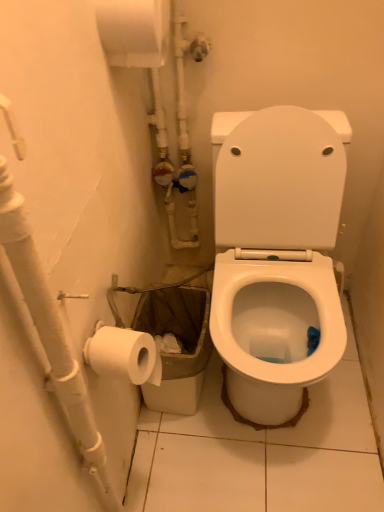
Question: Visually, is white matte water pipe at left positioned to the left or to the right of white matte toilet paper at upper left?

Choices:
 (A) left
 (B) right

Answer: (A)

Question: Relative to white matte toilet paper at upper left, is white matte water pipe at left in front or behind?

Choices:
 (A) front
 (B) behind

Answer: (A)

Question: Considering the positions of white matte water pipe at left and white matte toilet paper at upper left in the image, is white matte water pipe at left taller or shorter than white matte toilet paper at upper left?

Choices:
 (A) tall
 (B) short

Answer: (A)

Question: Is white matte toilet paper at upper left inside or outside of white matte water pipe at left?

Choices:
 (A) outside
 (B) inside

Answer: (A)

Question: Would you say white matte toilet paper at upper left is to the left or to the right of white matte water pipe at left in the picture?

Choices:
 (A) right
 (B) left

Answer: (A)

Question: Considering the positions of white matte toilet paper at upper left and white matte water pipe at left in the image, is white matte toilet paper at upper left wider or thinner than white matte water pipe at left?

Choices:
 (A) wide
 (B) thin

Answer: (A)

Question: Considering their positions, is white matte toilet paper at upper left located in front of or behind white matte water pipe at left?

Choices:
 (A) front
 (B) behind

Answer: (B)